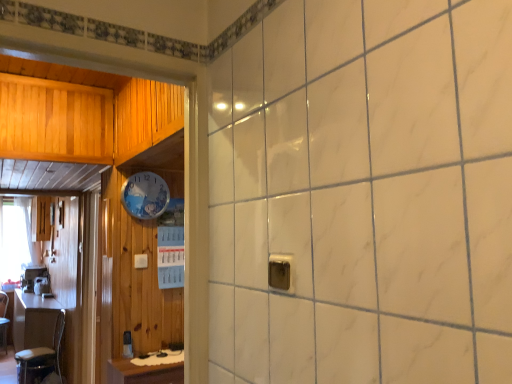
Question: Considering the positions of point (268, 256) and point (128, 185), is point (268, 256) closer or farther from the camera than point (128, 185)?

Choices:
 (A) closer
 (B) farther

Answer: (A)

Question: Is metallic silver outlet at center inside or outside of white glossy clock at upper center?

Choices:
 (A) inside
 (B) outside

Answer: (B)

Question: Which of these objects is positioned closest to the white glossy clock at upper center?

Choices:
 (A) metallic silver chair at left
 (B) white sheer curtain at left
 (C) wooden table at left
 (D) metallic silver outlet at center
 (E) wooden cabinet at left

Answer: (C)

Question: Which of these objects is positioned farthest from the wooden cabinet at left?

Choices:
 (A) white sheer curtain at left
 (B) white glossy clock at upper center
 (C) metallic silver chair at left
 (D) wooden table at left
 (E) metallic silver outlet at center

Answer: (E)